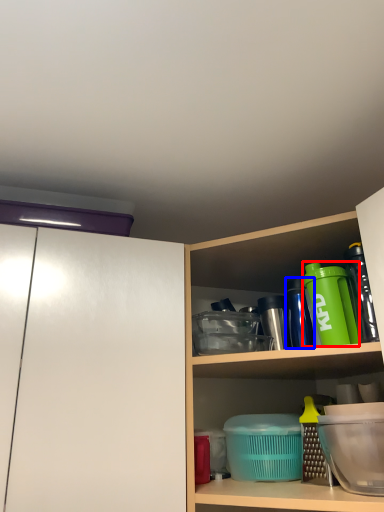
Question: Which object appears closest to the camera in this image, bottle (highlighted by a red box) or bottle (highlighted by a blue box)?

Choices:
 (A) bottle
 (B) bottle

Answer: (A)